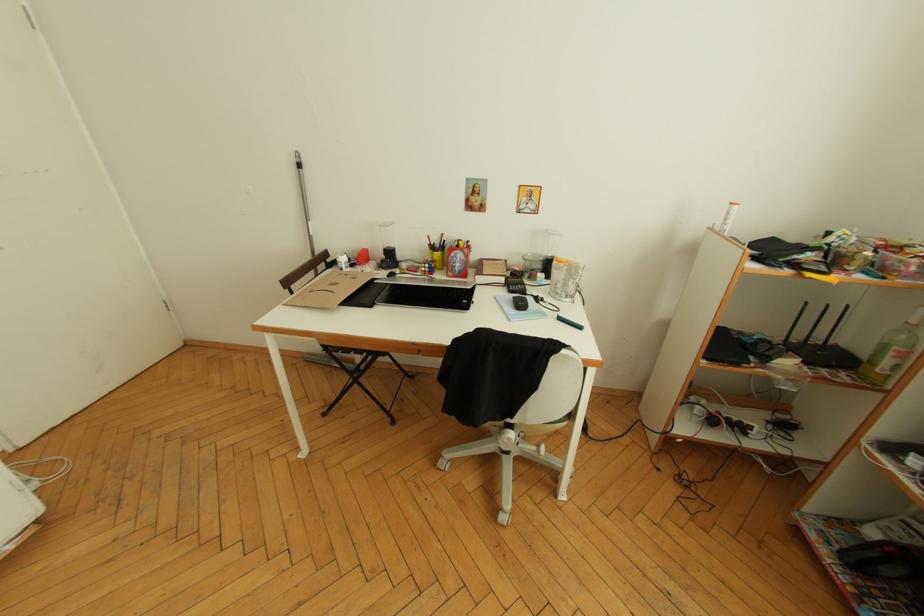
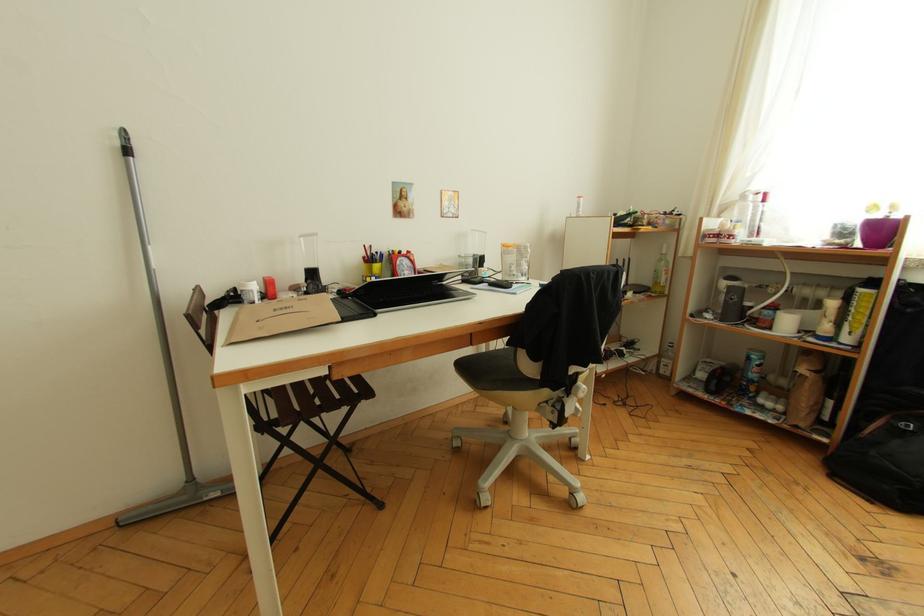
Question: The camera is either moving clockwise (left) or counter-clockwise (right) around the object. The first image is from the beginning of the video and the second image is from the end. Is the camera moving left or right when shooting the video?

Choices:
 (A) Left
 (B) Right

Answer: (A)